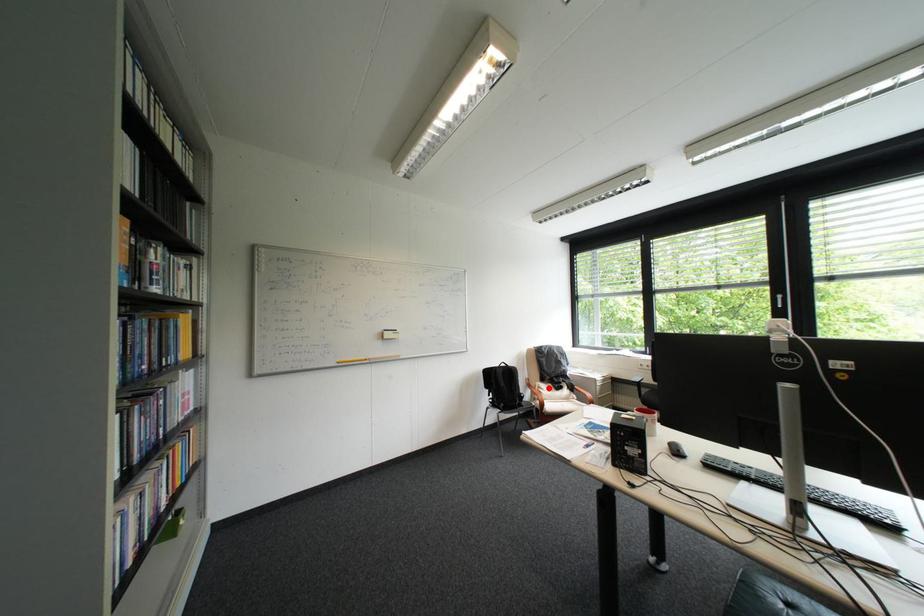
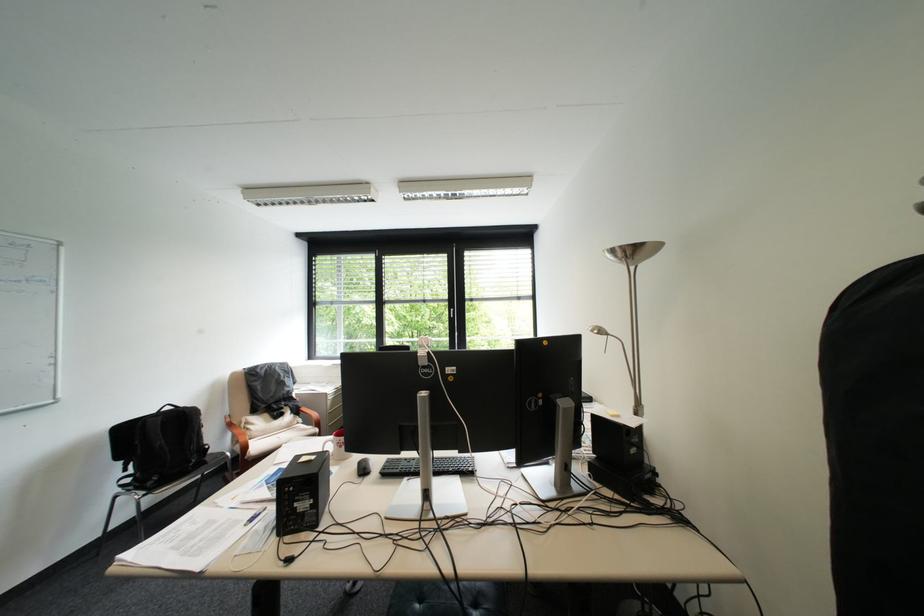
In the second image, find the point that corresponds to the highlighted location in the first image.

(256, 424)